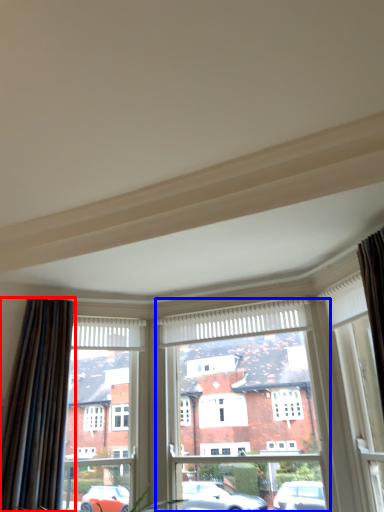
Question: Which of the following is the closest to the observer, curtain (highlighted by a red box) or window frame (highlighted by a blue box)?

Choices:
 (A) curtain
 (B) window frame

Answer: (A)